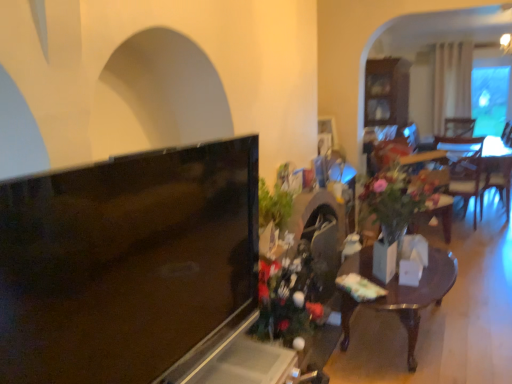
Image resolution: width=512 pixels, height=384 pixels. In order to click on vacant space to the right of wooden table at center in this screenshot , I will do `click(478, 309)`.